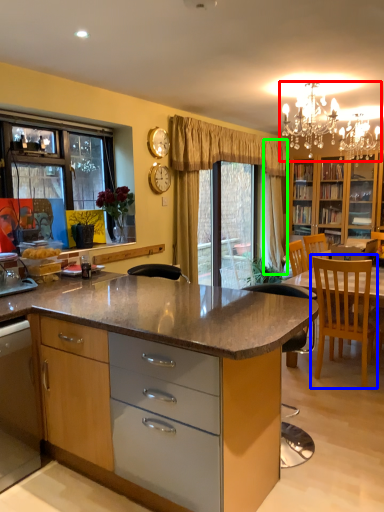
Question: Estimate the real-world distances between objects in this image. Which object is farther from light fixture (highlighted by a red box), chair (highlighted by a blue box) or curtain (highlighted by a green box)?

Choices:
 (A) chair
 (B) curtain

Answer: (A)